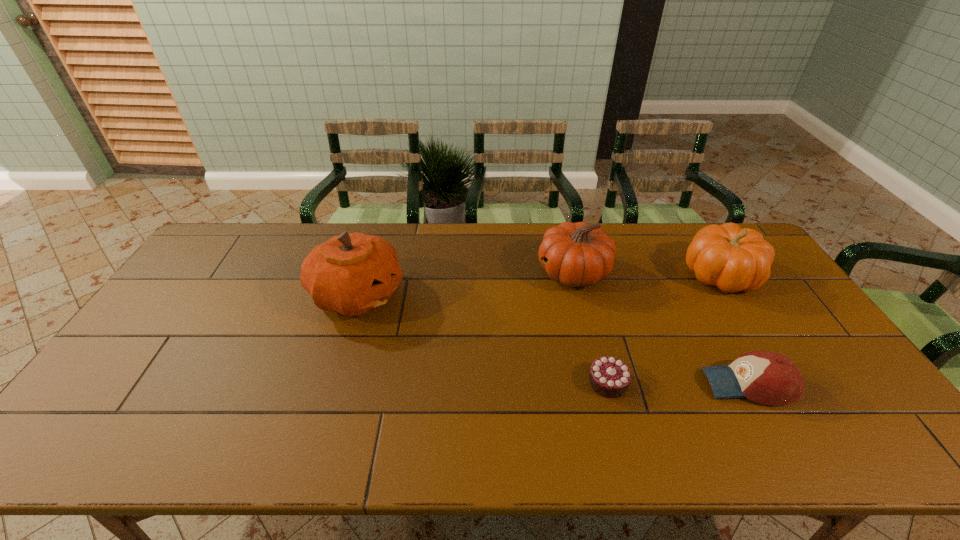
The width and height of the screenshot is (960, 540). Find the location of `free location that satisfies the following two spatial constraints: 1. on the face of the shortest object; 2. on the left side of the second pumpkin from left to right`. free location that satisfies the following two spatial constraints: 1. on the face of the shortest object; 2. on the left side of the second pumpkin from left to right is located at coordinates (600, 382).